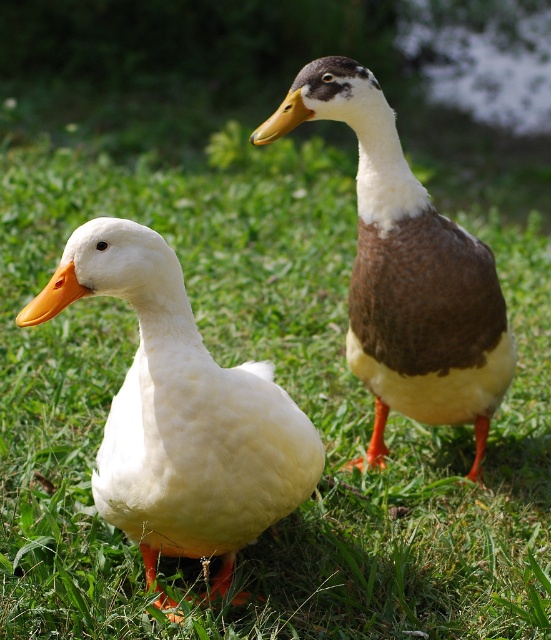
You are a birdwatcher trying to identify ducks in the image. You notice two ducks, the white matte duck at left and the brown matte duck at upper right. Which duck has a smaller body size?

The white matte duck at left has a smaller body size compared to the brown matte duck at upper right because its width is less than the brown duck.

You are a photographer trying to capture both the white matte duck at left and the brown matte duck at upper right in the same frame. Based on their positions, which duck will appear closer to the camera in the photo?

The white matte duck at left will appear closer to the camera because it is positioned in front of the brown matte duck at upper right.

You are a birdwatcher observing two ducks in a grassy area. You notice the white matte duck at left and the brown matte duck at upper right. Which duck is larger in size?

The brown matte duck at upper right is larger than the white matte duck at left.